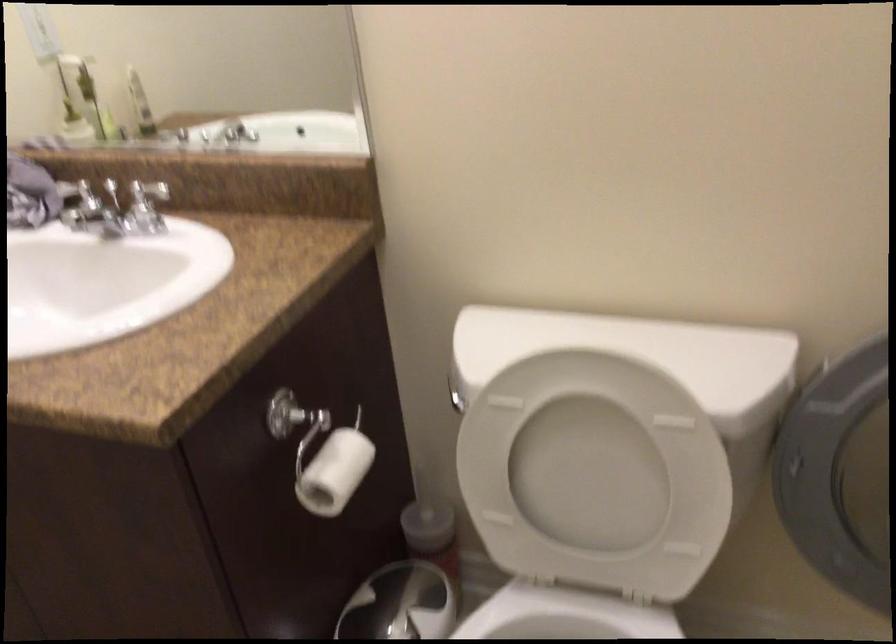
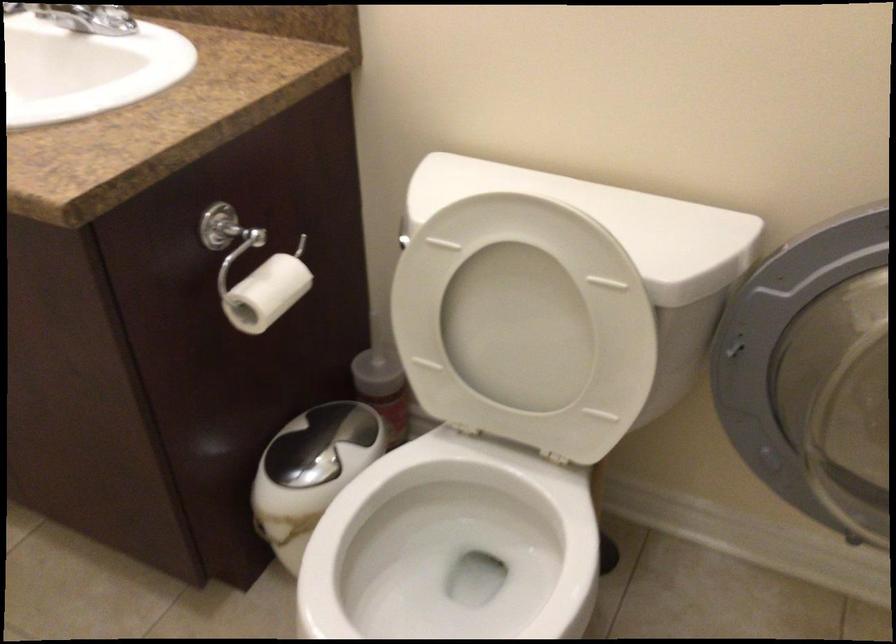
Locate, in the second image, the point that corresponds to (x=584, y=469) in the first image.

(517, 328)